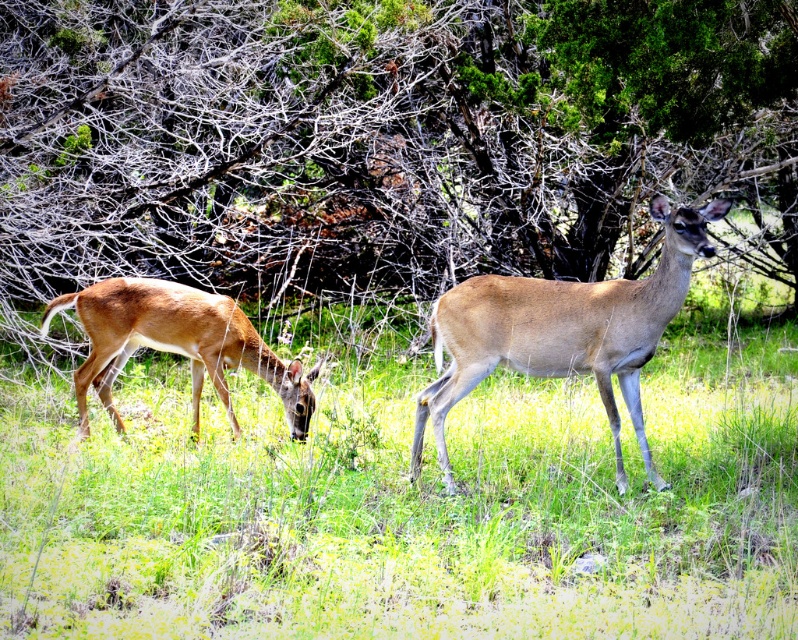
Describe the element at coordinates (563, 332) in the screenshot. The height and width of the screenshot is (640, 798). I see `brown matte/deer at center` at that location.

Between point (631, 292) and point (78, 307), which one is positioned behind?

Point (78, 307)

Locate an element on the screen. This screenshot has width=798, height=640. brown matte/deer at center is located at coordinates (563, 332).

Which is in front, point (463, 273) or point (635, 355)?

Point (635, 355) is in front.

Which of these two, green leafy tree at center or brown matte/deer at center, stands taller?

Standing taller between the two is green leafy tree at center.

Measure the distance between green leafy tree at center and camera.

The distance of green leafy tree at center from camera is 19.43 feet.

This screenshot has height=640, width=798. I want to click on green leafy tree at center, so click(358, 138).

Is green leafy tree at center further to the viewer compared to brown fur deer at center?

Yes, it is behind brown fur deer at center.

Between green leafy tree at center and brown fur deer at center, which one has more height?

Standing taller between the two is green leafy tree at center.

This screenshot has width=798, height=640. In order to click on green leafy tree at center in this screenshot , I will do `click(358, 138)`.